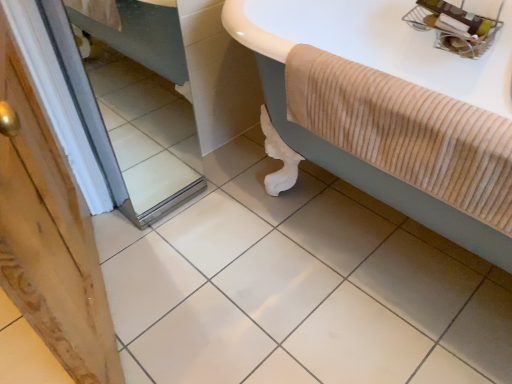
Question: In terms of height, does mirror at left look taller or shorter compared to beige corduroy bathtub at upper right?

Choices:
 (A) short
 (B) tall

Answer: (B)

Question: From a real-world perspective, is mirror at left above or below beige corduroy bathtub at upper right?

Choices:
 (A) above
 (B) below

Answer: (B)

Question: Which is farther from the beige corduroy bathtub at upper right?

Choices:
 (A) mirror at left
 (B) white glossy ceramic tile at center

Answer: (A)

Question: Estimate the real-world distances between objects in this image. Which object is farther from the white glossy ceramic tile at center?

Choices:
 (A) beige corduroy bathtub at upper right
 (B) mirror at left

Answer: (A)